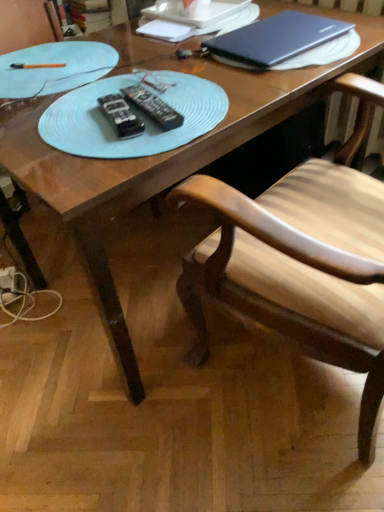
Find the location of a particular element. This screenshot has width=384, height=512. vacant area that lies to the right of black plastic remote at center, the first remote in the right-to-left sequence is located at coordinates (219, 99).